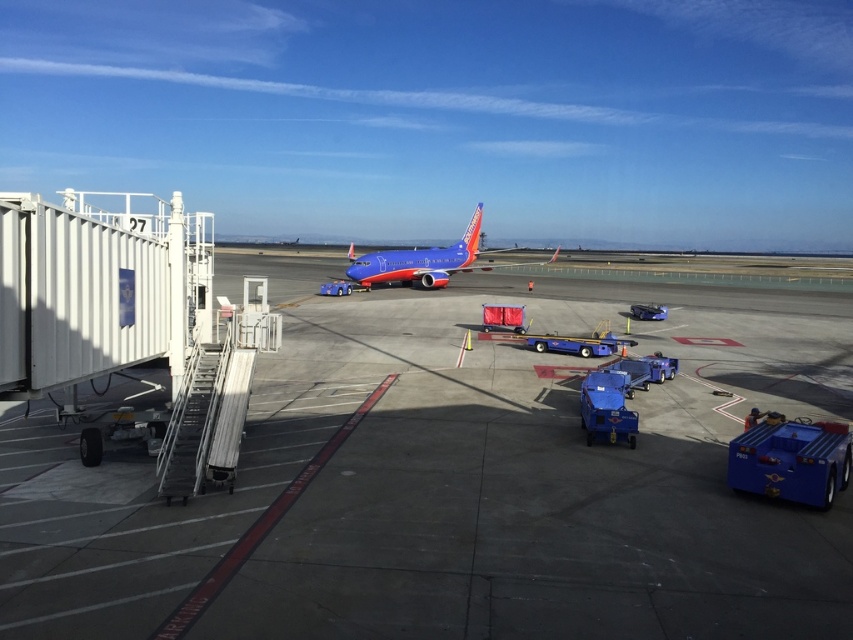
Question: In this image, where is smooth concrete tarmac at center located relative to blue painted airplane at center?

Choices:
 (A) below
 (B) above

Answer: (A)

Question: Among these objects, which one is farthest from the camera?

Choices:
 (A) blue painted airplane at center
 (B) smooth concrete tarmac at center

Answer: (A)

Question: Can you confirm if smooth concrete tarmac at center is positioned above blue painted airplane at center?

Choices:
 (A) yes
 (B) no

Answer: (B)

Question: Does smooth concrete tarmac at center lie behind blue painted airplane at center?

Choices:
 (A) no
 (B) yes

Answer: (A)

Question: Which object appears closest to the camera in this image?

Choices:
 (A) smooth concrete tarmac at center
 (B) blue painted airplane at center

Answer: (A)